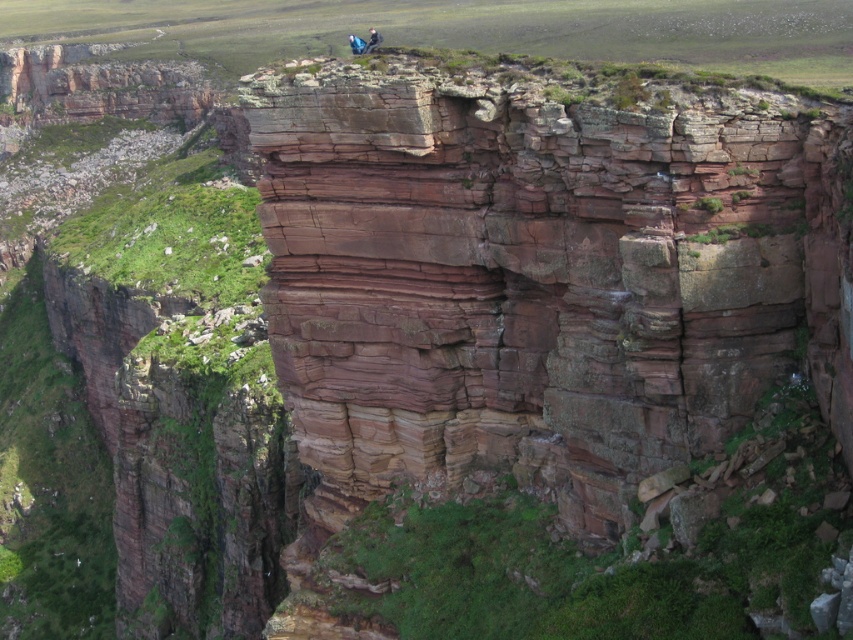
You are a hiker planning to join the group at the top of the cliff. You see two hikers labeled as dark blue fabric hiker at upper center and blue fabric fabric hiker at upper center. Which hiker is taller?

The dark blue fabric hiker at upper center is taller than the blue fabric hiker at upper center.